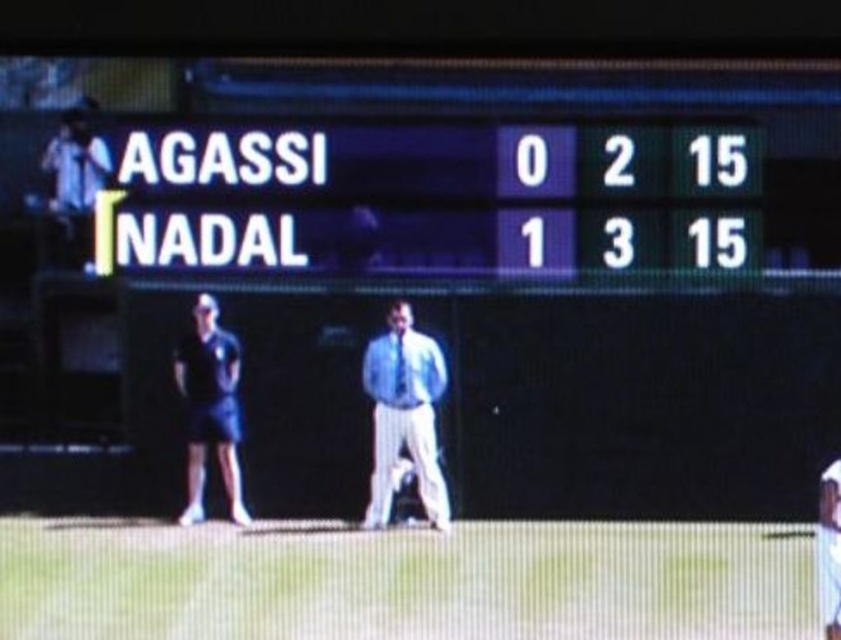
Question: Which object is positioned farthest from the white cotton shirt at lower right?

Choices:
 (A) light blue pinstripe pants at center
 (B) dark blue fabric shorts at left

Answer: (B)

Question: Observing the image, what is the correct spatial positioning of light blue pinstripe pants at center in reference to dark blue fabric shorts at left?

Choices:
 (A) below
 (B) above

Answer: (A)

Question: Which point is farther from the camera taking this photo?

Choices:
 (A) (229, 387)
 (B) (383, 378)

Answer: (B)

Question: Which point is closer to the camera?

Choices:
 (A) [818, 506]
 (B) [427, 429]
 (C) [210, 419]

Answer: (C)

Question: Does light blue pinstripe pants at center appear on the right side of white cotton shirt at lower right?

Choices:
 (A) yes
 (B) no

Answer: (B)

Question: Does dark blue fabric shorts at left have a greater width compared to white cotton shirt at lower right?

Choices:
 (A) yes
 (B) no

Answer: (A)